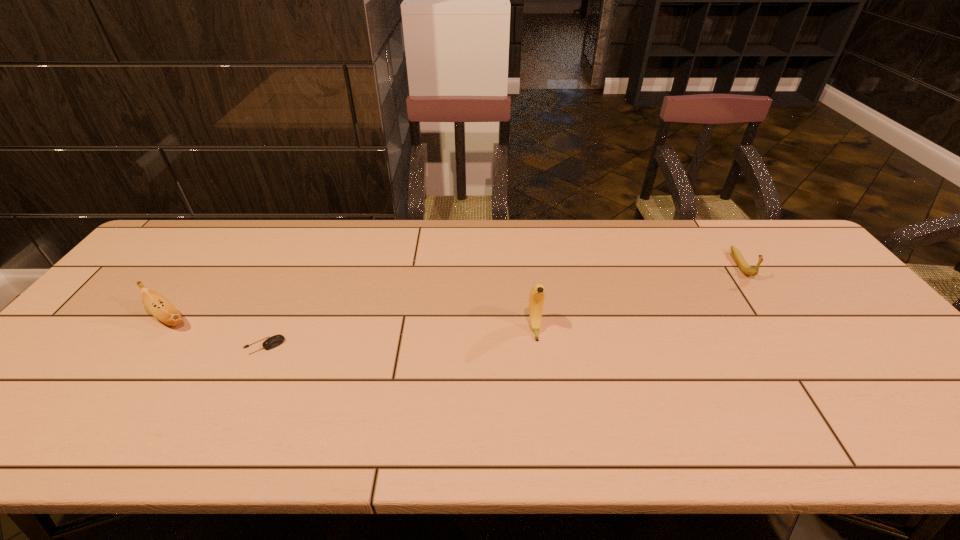
Find the location of a particular element. free space that is in between the third object from right to left and the tallest banana is located at coordinates (399, 338).

This screenshot has width=960, height=540. What are the coordinates of `empty location between the farthest banana and the tallest banana` in the screenshot? It's located at (637, 297).

You are a GUI agent. You are given a task and a screenshot of the screen. Output one action in this format:
    pyautogui.click(x=<x>, y=<y>)
    Task: Click on the free space between the mouse and the tallest object
    This screenshot has width=960, height=540.
    Given the screenshot: What is the action you would take?
    pyautogui.click(x=399, y=338)

Identify the location of vacant area between the third object from right to left and the leftmost object. (217, 332).

Where is `vacant space that is in between the tallest object and the mouse`? The width and height of the screenshot is (960, 540). vacant space that is in between the tallest object and the mouse is located at coordinates (399, 338).

At what (x,y) coordinates should I click in order to perform the action: click on vacant area that lies between the farthest banana and the second banana from right to left. Please return your answer as a coordinate pair (x, y). Looking at the image, I should click on (637, 297).

The image size is (960, 540). Identify the location of object that is the third closest to the shortest object. (741, 263).

Identify which object is located as the third nearest to the mouse. Please provide its 2D coordinates. Your answer should be formatted as a tuple, i.e. [(x, y)], where the tuple contains the x and y coordinates of a point satisfying the conditions above.

[(741, 263)]

Image resolution: width=960 pixels, height=540 pixels. Identify the location of banana that is the closest one to the tallest banana. (741, 263).

Select which banana is the second closest to the third object from left to right. Please provide its 2D coordinates. Your answer should be formatted as a tuple, i.e. [(x, y)], where the tuple contains the x and y coordinates of a point satisfying the conditions above.

[(157, 305)]